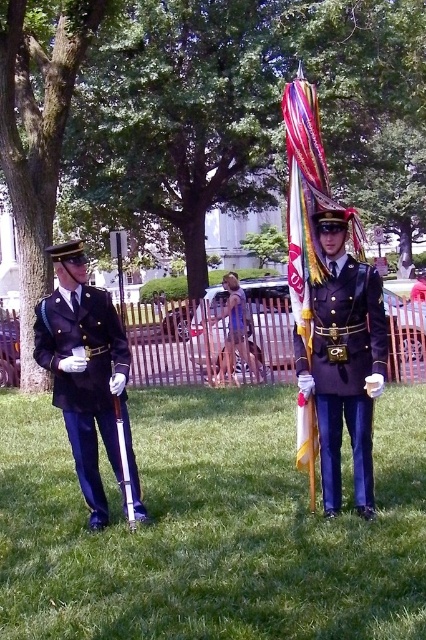
Which is below, shiny dark blue uniform at center or shiny metallic flag at center?

shiny dark blue uniform at center is below.

Can you confirm if shiny dark blue uniform at center is positioned to the right of shiny metallic flag at center?

Indeed, shiny dark blue uniform at center is positioned on the right side of shiny metallic flag at center.

Is point (368, 436) farther from viewer compared to point (307, 440)?

No, it is not.

Locate an element on the screen. The image size is (426, 640). shiny dark blue uniform at center is located at coordinates (345, 372).

Can you confirm if shiny dark blue uniform at center is taller than navy blue fabric uniform at left?

Yes, shiny dark blue uniform at center is taller than navy blue fabric uniform at left.

Measure the distance between point (336, 429) and camera.

They are 3.47 meters apart.

Locate an element on the screen. The height and width of the screenshot is (640, 426). shiny dark blue uniform at center is located at coordinates (345, 372).

Is navy blue fabric uniform at left shorter than shiny metallic flag at center?

Indeed, navy blue fabric uniform at left has a lesser height compared to shiny metallic flag at center.

Which is behind, point (101, 344) or point (333, 202)?

Positioned behind is point (101, 344).

Locate an element on the screen. The image size is (426, 640). navy blue fabric uniform at left is located at coordinates (89, 387).